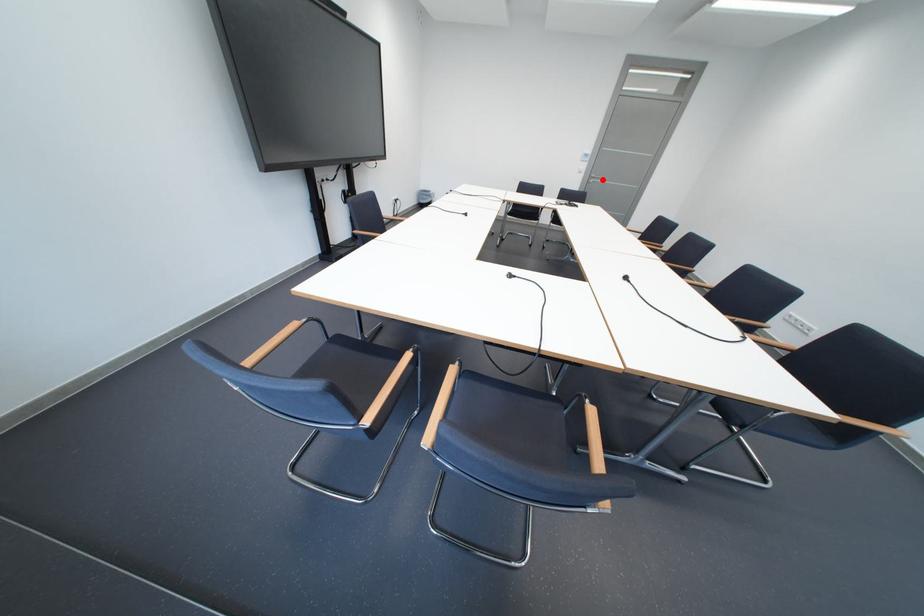
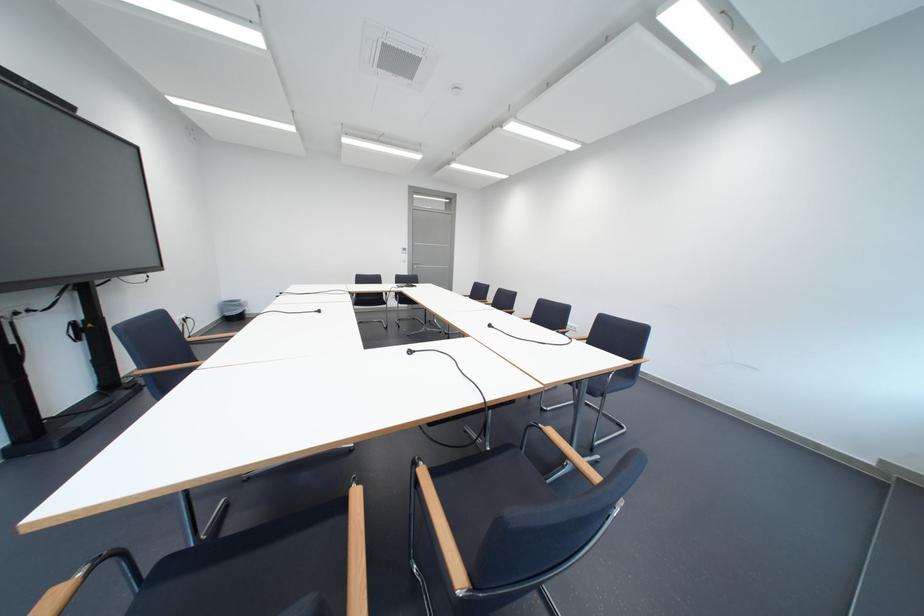
The point at the highlighted location is marked in the first image. Where is the corresponding point in the second image?

(426, 265)